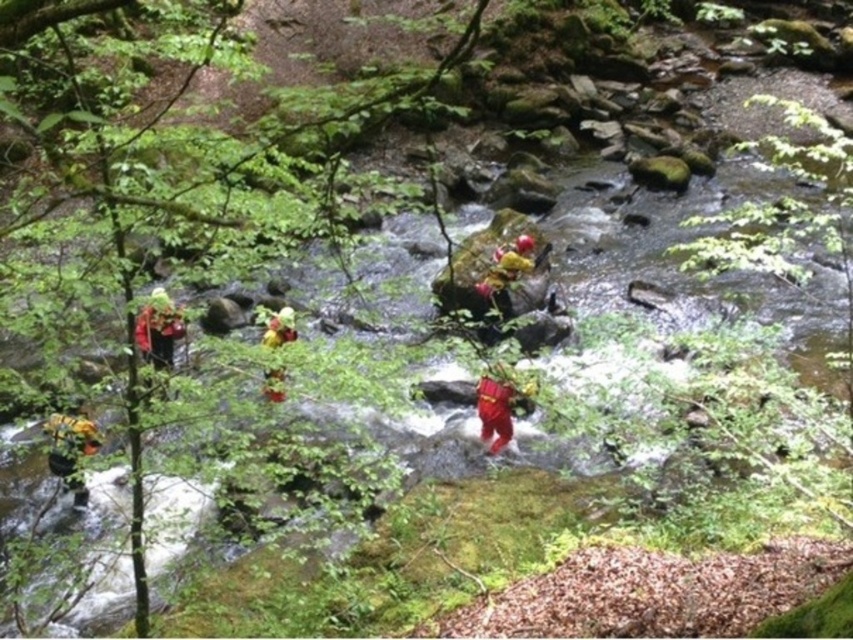
Question: Can you confirm if yellow-orange helmet at lower left is positioned to the right of matte red helmet at left?

Choices:
 (A) no
 (B) yes

Answer: (A)

Question: Which object appears closest to the camera in this image?

Choices:
 (A) yellow-orange helmet at lower left
 (B) matte red helmet at left

Answer: (B)

Question: Which point is closer to the camera taking this photo?

Choices:
 (A) (490, 392)
 (B) (86, 426)

Answer: (B)

Question: Can you confirm if yellow-orange helmet at lower left is bigger than matte yellow helmet at center?

Choices:
 (A) no
 (B) yes

Answer: (B)

Question: Does matte red pants at center appear on the right side of yellow fabric person at center?

Choices:
 (A) no
 (B) yes

Answer: (A)

Question: Based on their relative distances, which object is nearer to the yellow-orange helmet at lower left?

Choices:
 (A) matte red helmet at left
 (B) matte yellow helmet at center
 (C) matte red pants at center
 (D) yellow fabric person at center

Answer: (A)